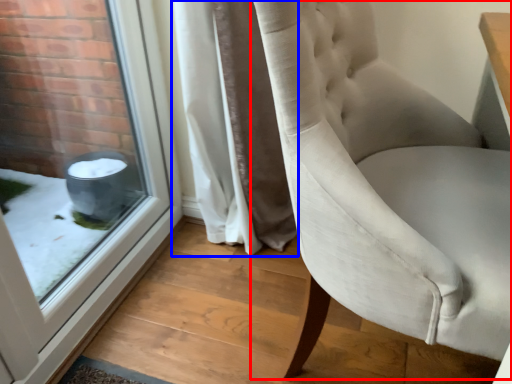
Question: Which object appears farthest to the camera in this image, chair (highlighted by a red box) or curtain (highlighted by a blue box)?

Choices:
 (A) chair
 (B) curtain

Answer: (B)